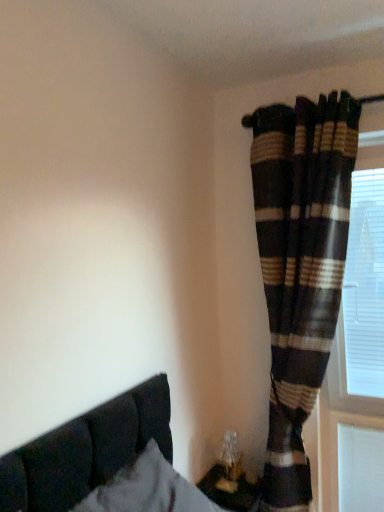
Question: Considering the relative sizes of plaid fabric curtain at right and suede-like dark brown bed at lower left in the image provided, is plaid fabric curtain at right wider than suede-like dark brown bed at lower left?

Choices:
 (A) no
 (B) yes

Answer: (A)

Question: Does plaid fabric curtain at right have a larger size compared to suede-like dark brown bed at lower left?

Choices:
 (A) yes
 (B) no

Answer: (A)

Question: Is plaid fabric curtain at right outside of suede-like dark brown bed at lower left?

Choices:
 (A) no
 (B) yes

Answer: (B)

Question: Does plaid fabric curtain at right come behind suede-like dark brown bed at lower left?

Choices:
 (A) yes
 (B) no

Answer: (A)

Question: From the image's perspective, is plaid fabric curtain at right on top of suede-like dark brown bed at lower left?

Choices:
 (A) no
 (B) yes

Answer: (B)

Question: Is plaid fabric curtain at right not close to suede-like dark brown bed at lower left?

Choices:
 (A) no
 (B) yes

Answer: (A)

Question: Would you say white plastic blinds at right contains suede-like dark brown bed at lower left?

Choices:
 (A) no
 (B) yes

Answer: (A)

Question: Does white plastic blinds at right have a greater height compared to suede-like dark brown bed at lower left?

Choices:
 (A) no
 (B) yes

Answer: (B)

Question: From a real-world perspective, does white plastic blinds at right stand above suede-like dark brown bed at lower left?

Choices:
 (A) yes
 (B) no

Answer: (A)

Question: From a real-world perspective, is white plastic blinds at right physically below suede-like dark brown bed at lower left?

Choices:
 (A) yes
 (B) no

Answer: (B)

Question: Is white plastic blinds at right touching suede-like dark brown bed at lower left?

Choices:
 (A) yes
 (B) no

Answer: (B)

Question: Does white plastic blinds at right appear on the right side of suede-like dark brown bed at lower left?

Choices:
 (A) no
 (B) yes

Answer: (B)

Question: From the image's perspective, is plaid fabric curtain at right on top of white plastic blinds at right?

Choices:
 (A) yes
 (B) no

Answer: (B)